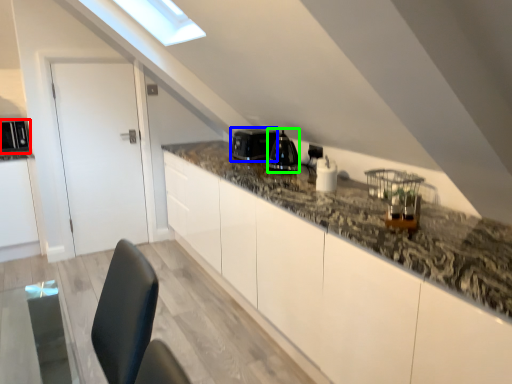
Question: Estimate the real-world distances between objects in this image. Which object is farther from appliance (highlighted by a red box), appliance (highlighted by a blue box) or appliance (highlighted by a green box)?

Choices:
 (A) appliance
 (B) appliance

Answer: (B)